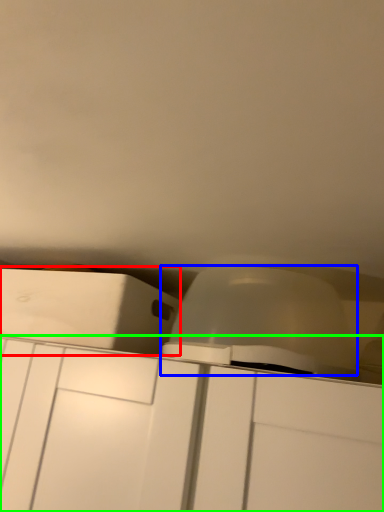
Question: Estimate the real-world distances between objects in this image. Which object is closer to cabinetry (highlighted by a red box), lift (highlighted by a blue box) or cabinetry (highlighted by a green box)?

Choices:
 (A) lift
 (B) cabinetry

Answer: (B)